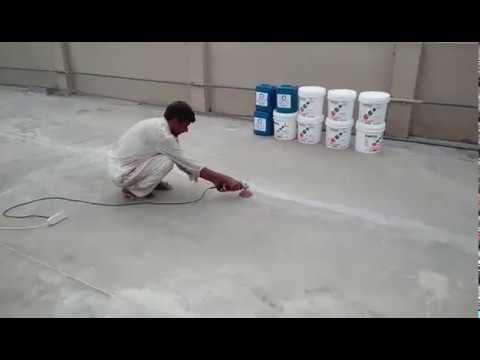
Where is `concrete style floor`? concrete style floor is located at coordinates pyautogui.click(x=87, y=124).